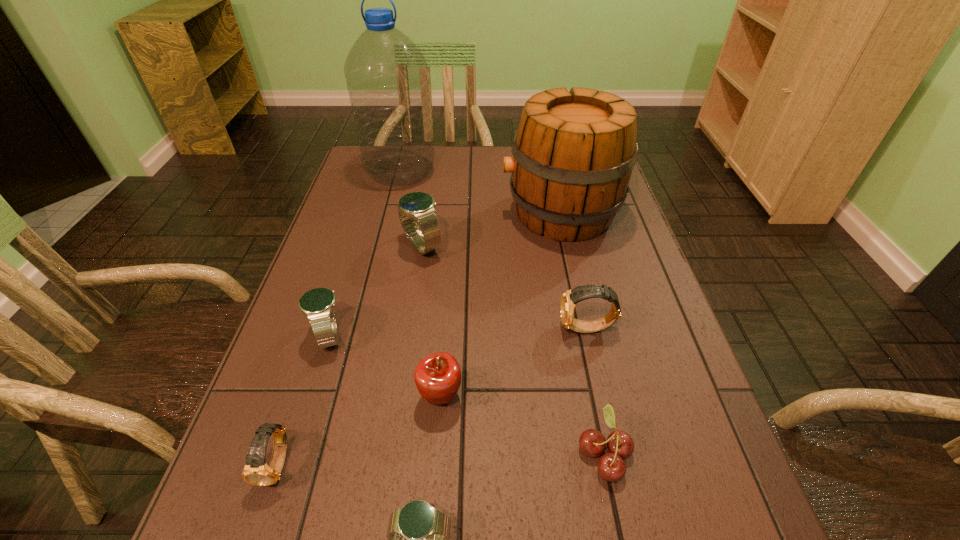
This screenshot has width=960, height=540. I want to click on blue water jug, so click(x=387, y=79).

The width and height of the screenshot is (960, 540). I want to click on water jug, so click(x=387, y=79).

The height and width of the screenshot is (540, 960). Find the location of `the eighth shortest object`. the eighth shortest object is located at coordinates (574, 151).

Find the location of a particular element. This screenshot has height=540, width=960. the farthest blue watch is located at coordinates (417, 206).

Where is `the biggest blue watch`? This screenshot has height=540, width=960. the biggest blue watch is located at coordinates (417, 206).

Locate an element on the screen. This screenshot has width=960, height=540. the right gold watch is located at coordinates (570, 298).

The height and width of the screenshot is (540, 960). In order to click on the farther gold watch in this screenshot , I will do `click(570, 298)`.

Identify the location of the leftmost blue watch. (317, 304).

What are the coordinates of `the second nearest blue watch` in the screenshot? It's located at (317, 304).

Image resolution: width=960 pixels, height=540 pixels. Find the location of `the fourth nearest object`. the fourth nearest object is located at coordinates pos(438,376).